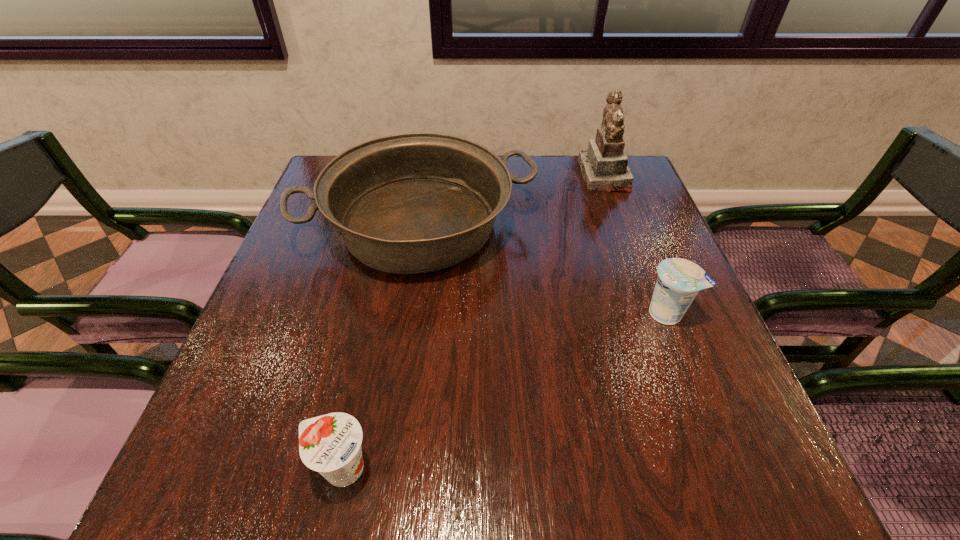
You are a GUI agent. You are given a task and a screenshot of the screen. Output one action in this format:
    pyautogui.click(x=<x>, y=<y>)
    Task: Click on the free space that satisfies the following two spatial constraints: 1. on the front-facing side of the tallest object; 2. on the back side of the right yogurt
    
    Given the screenshot: What is the action you would take?
    pyautogui.click(x=655, y=313)

The image size is (960, 540). I want to click on vacant point that satisfies the following two spatial constraints: 1. on the back side of the farther yogurt; 2. on the front-facing side of the tallest object, so click(x=613, y=176).

Identify the location of vacant region that satisfies the following two spatial constraints: 1. on the back side of the third farthest object; 2. on the front-facing side of the tallest object. The width and height of the screenshot is (960, 540). pyautogui.click(x=613, y=176).